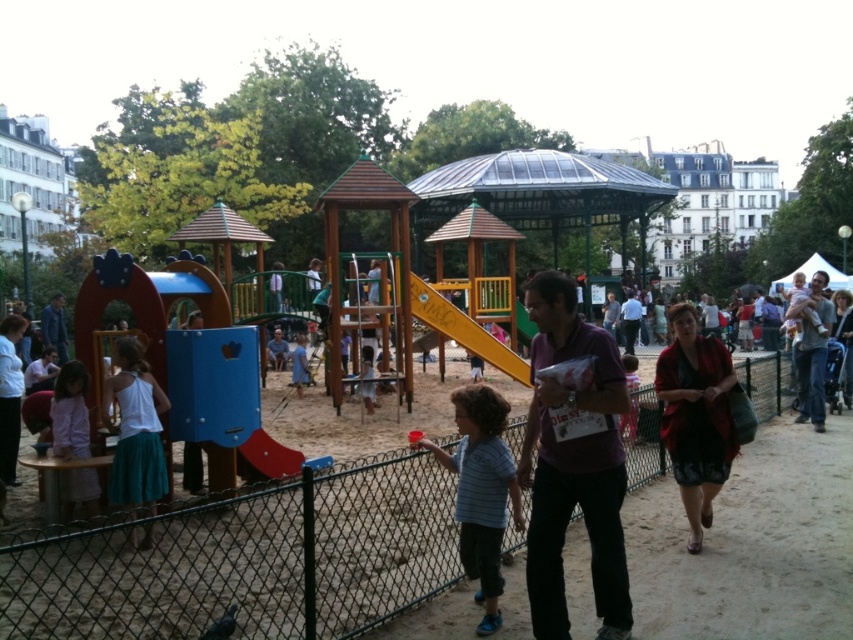
Question: Estimate the real-world distances between objects in this image. Which object is closer to the blue plastic slide at center?

Choices:
 (A) yellow matte slide at center
 (B) green chain-link fence at center
 (C) blue fabric jacket at left

Answer: (A)

Question: Which point is farther to the camera?

Choices:
 (A) blue striped shirt at center
 (B) matte brown shirt at right
 (C) blue fabric jacket at left
 (D) pale pink fabric dress at left

Answer: (C)

Question: Estimate the real-world distances between objects in this image. Which object is closer to the green chain-link fence at center?

Choices:
 (A) matte brown shirt at right
 (B) red plastic slide at center
 (C) yellow matte slide at center

Answer: (B)

Question: Does yellow matte slide at center lie behind light blue fabric shirt at center?

Choices:
 (A) yes
 (B) no

Answer: (A)

Question: Is matte brown shirt at right below light blue fabric dress at center?

Choices:
 (A) no
 (B) yes

Answer: (A)

Question: Considering the relative positions of pale pink fabric dress at left and light blue fabric shirt at center in the image provided, where is pale pink fabric dress at left located with respect to light blue fabric shirt at center?

Choices:
 (A) left
 (B) right

Answer: (A)